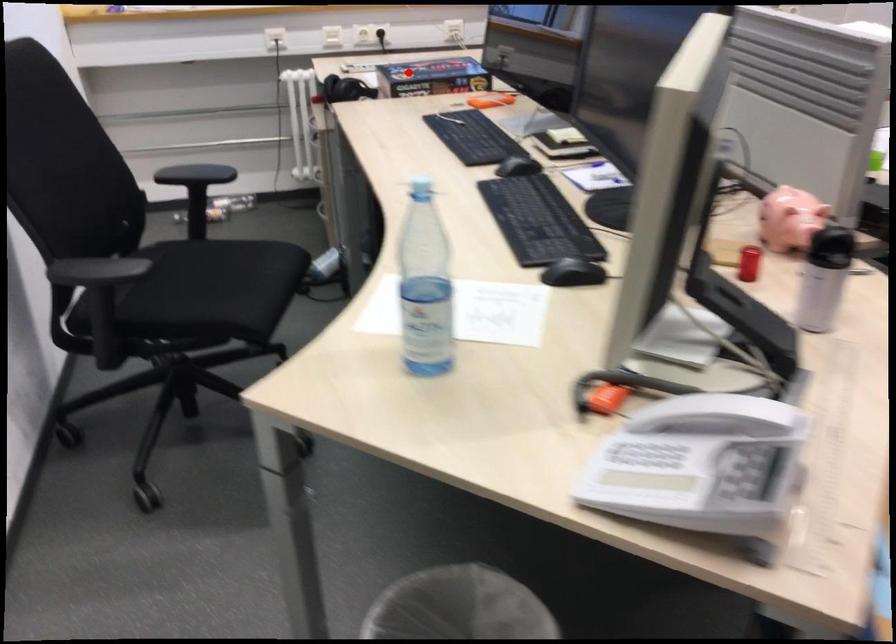
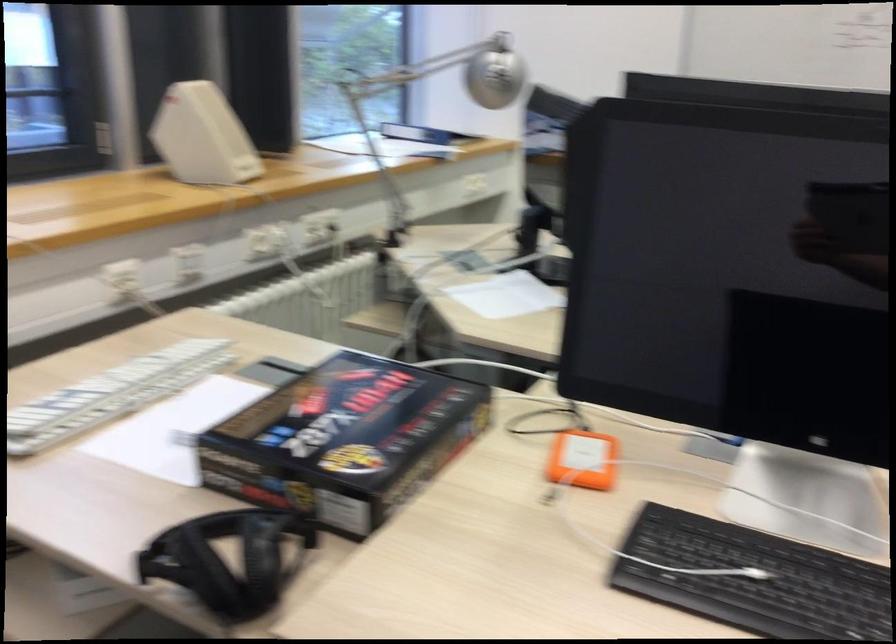
Question: I am providing you with two images of the same scene from different viewpoints. In image1, a red point is highlighted. Considering the same 3D point in image2, which of the following is correct?

Choices:
 (A) It is closer
 (B) It is farther

Answer: (A)